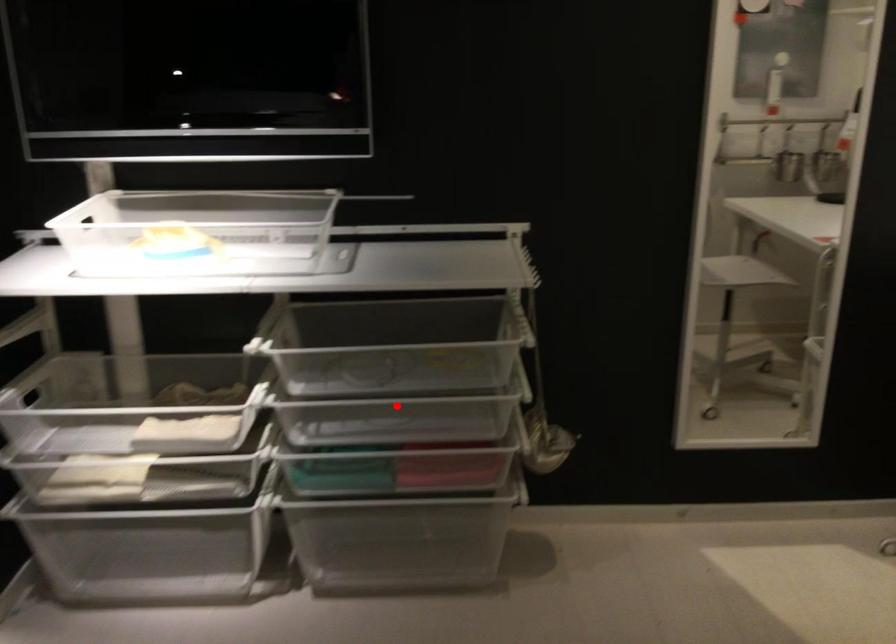
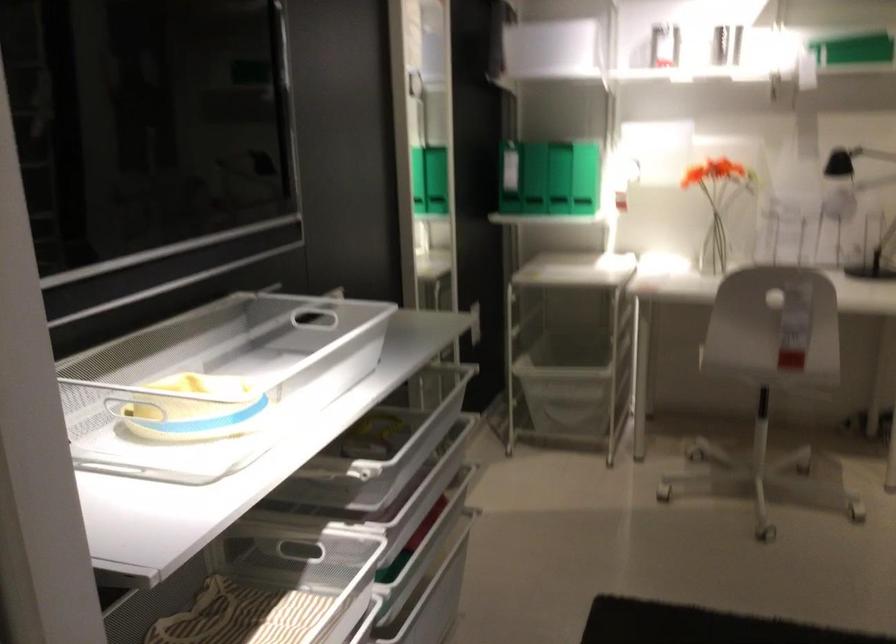
Question: I am providing you with two images of the same scene from different viewpoints. A red point is marked on the first image. Is the red point's position out of view in image 2?

Choices:
 (A) Yes
 (B) No

Answer: (A)